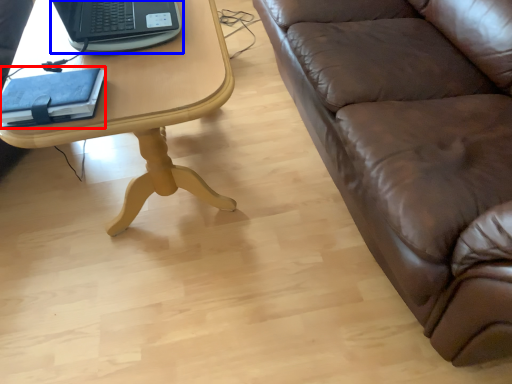
Question: Which object appears closest to the camera in this image, notebook (highlighted by a red box) or laptop (highlighted by a blue box)?

Choices:
 (A) notebook
 (B) laptop

Answer: (A)